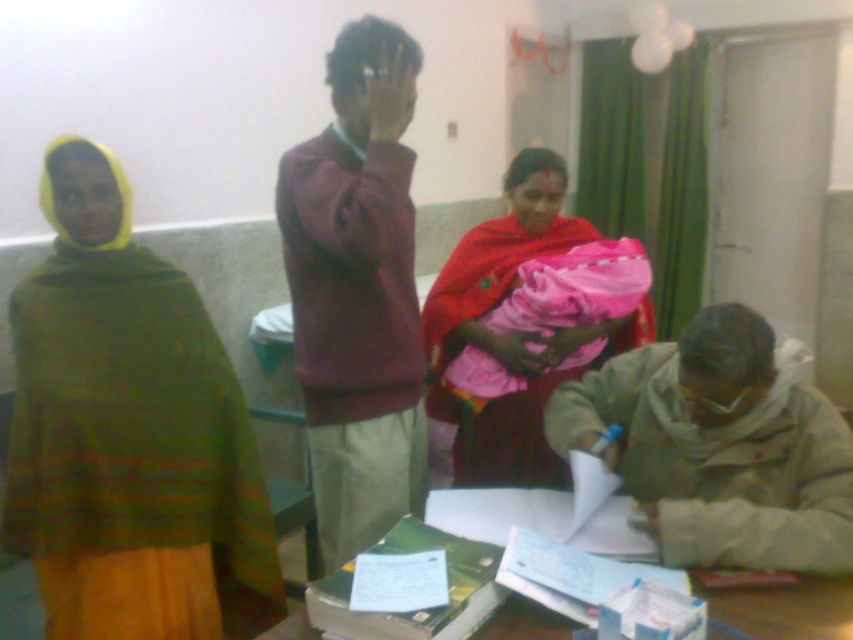
Find the location of a particular element. green textured shawl at left is located at coordinates (129, 435).

Does green textured shawl at left appear over beige fabric jacket at lower right?

No, green textured shawl at left is not above beige fabric jacket at lower right.

Who is more distant from viewer, (71, 257) or (647, 404)?

Positioned behind is point (647, 404).

At what (x,y) coordinates should I click in order to perform the action: click on green textured shawl at left. Please return your answer as a coordinate pair (x, y). This screenshot has height=640, width=853. Looking at the image, I should click on (129, 435).

Who is more forward, [248,440] or [309,628]?

Point [309,628] is more forward.

Does green textured shawl at left lie in front of paper-covered table at lower center?

That is False.

Is point (257, 502) in front of point (497, 625)?

No, (257, 502) is further to viewer.

Image resolution: width=853 pixels, height=640 pixels. I want to click on green textured shawl at left, so click(x=129, y=435).

Can you confirm if maroon sweater at center is bigger than paper-covered table at lower center?

Yes.

Is the position of maroon sweater at center more distant than that of paper-covered table at lower center?

That is True.

Where is `maroon sweater at center`? The image size is (853, 640). maroon sweater at center is located at coordinates (357, 291).